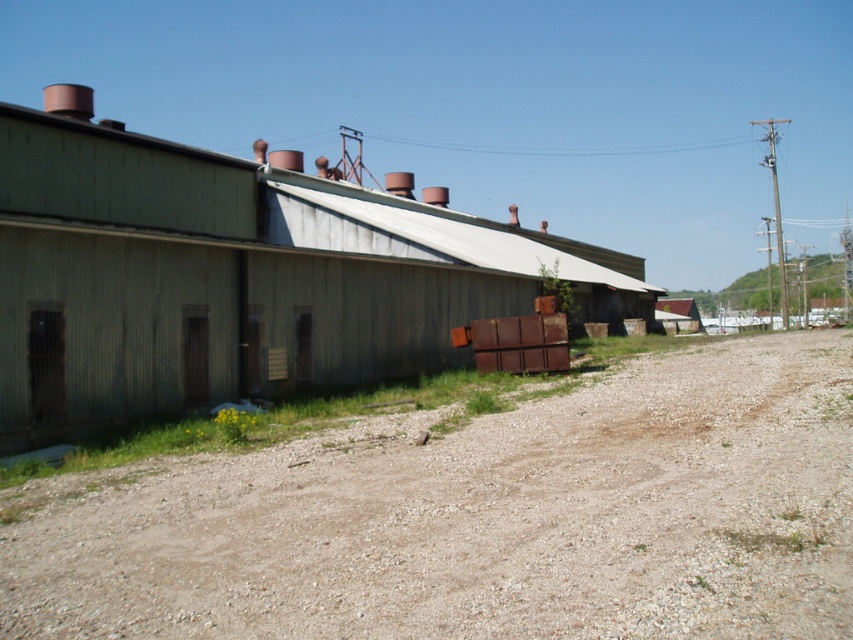
Question: Can you confirm if brown gravel dirt track at center is positioned to the left of green corrugated metal barn at center?

Choices:
 (A) yes
 (B) no

Answer: (A)

Question: Which object appears closest to the camera in this image?

Choices:
 (A) brown gravel dirt track at center
 (B) green corrugated metal barn at center

Answer: (A)

Question: Which point appears farthest from the camera in this image?

Choices:
 (A) (784, 490)
 (B) (238, 237)

Answer: (B)

Question: Does brown gravel dirt track at center come in front of green corrugated metal barn at center?

Choices:
 (A) no
 (B) yes

Answer: (B)

Question: Does brown gravel dirt track at center have a lesser width compared to green corrugated metal barn at center?

Choices:
 (A) no
 (B) yes

Answer: (B)

Question: Which point is farther to the camera?

Choices:
 (A) green corrugated metal barn at center
 (B) brown gravel dirt track at center

Answer: (A)